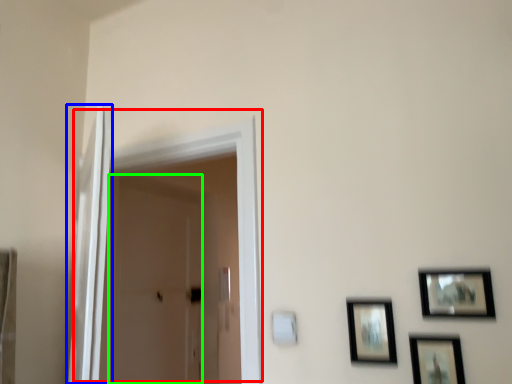
Question: Based on their relative distances, which object is farther from door (highlighted by a red box)? Choose from screen door (highlighted by a blue box) and screen door (highlighted by a green box).

Choices:
 (A) screen door
 (B) screen door

Answer: (B)